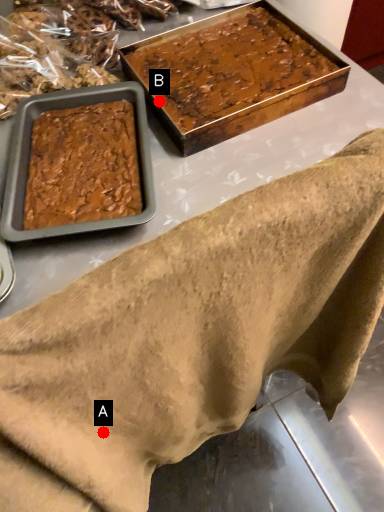
Question: Two points are circled on the image, labeled by A and B beside each circle. Which point appears closest to the camera in this image?

Choices:
 (A) A is closer
 (B) B is closer

Answer: (A)